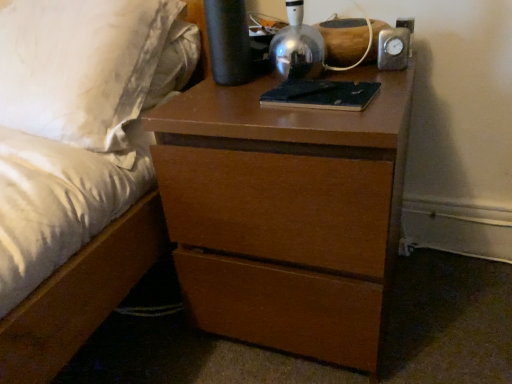
At what (x,y) coordinates should I click in order to perform the action: click on blank space to the left of dark blue leather book at center. Please return your answer as a coordinate pair (x, y). Looking at the image, I should click on (229, 104).